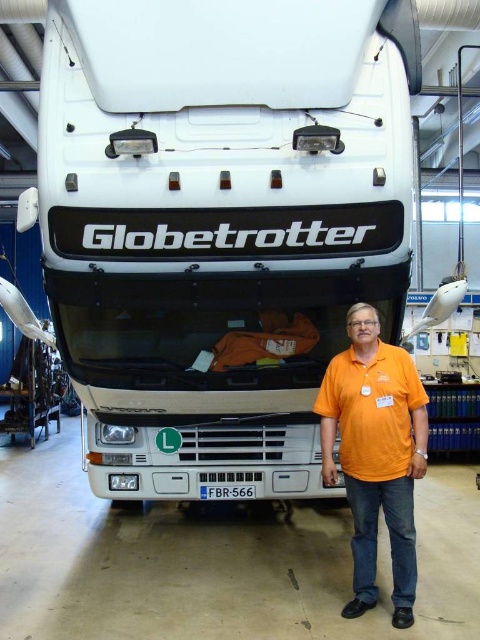
Where is the white matte truck at center located in the image?

The white matte truck at center is located at point 0.355 on the x axis and 0.456 on the y axis.